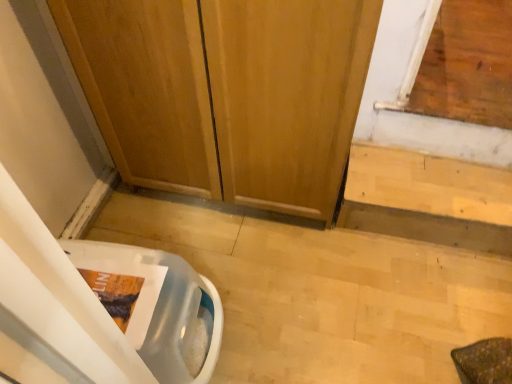
Question: Is wooden door at center with translucent plastic toilet bowl at lower left?

Choices:
 (A) yes
 (B) no

Answer: (B)

Question: Is translucent plastic toilet bowl at lower left surrounded by wooden door at center?

Choices:
 (A) yes
 (B) no

Answer: (B)

Question: Does wooden door at center turn towards translucent plastic toilet bowl at lower left?

Choices:
 (A) yes
 (B) no

Answer: (A)

Question: Does wooden door at center lie in front of translucent plastic toilet bowl at lower left?

Choices:
 (A) no
 (B) yes

Answer: (B)

Question: Can you confirm if wooden door at center is taller than translucent plastic toilet bowl at lower left?

Choices:
 (A) no
 (B) yes

Answer: (B)

Question: From the image's perspective, is wooden door at center above translucent plastic toilet bowl at lower left?

Choices:
 (A) yes
 (B) no

Answer: (A)

Question: Is wooden door at center bigger than light wood stairs at lower right?

Choices:
 (A) yes
 (B) no

Answer: (A)

Question: From a real-world perspective, is wooden door at center beneath light wood stairs at lower right?

Choices:
 (A) no
 (B) yes

Answer: (A)

Question: Can we say wooden door at center lies outside light wood stairs at lower right?

Choices:
 (A) no
 (B) yes

Answer: (B)

Question: Is wooden door at center aimed at light wood stairs at lower right?

Choices:
 (A) no
 (B) yes

Answer: (A)

Question: Is wooden door at center next to light wood stairs at lower right?

Choices:
 (A) no
 (B) yes

Answer: (A)

Question: Is wooden door at center shorter than light wood stairs at lower right?

Choices:
 (A) yes
 (B) no

Answer: (B)

Question: Is translucent plastic toilet bowl at lower left surrounding light wood stairs at lower right?

Choices:
 (A) yes
 (B) no

Answer: (B)